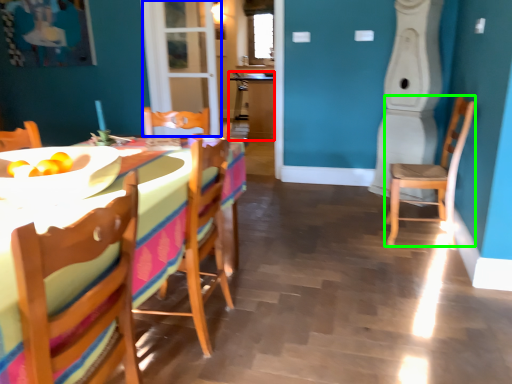
Question: Which object is positioned closest to table (highlighted by a red box)? Select from glass door (highlighted by a blue box) and chair (highlighted by a green box).

Choices:
 (A) glass door
 (B) chair

Answer: (A)